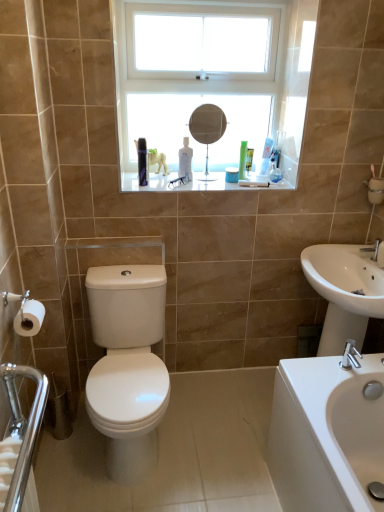
Question: Is green matte bottle at upper center, the second toiletry viewed from the top, positioned with its back to white glossy sink at lower right, which appears as the first sink when ordered from the bottom?

Choices:
 (A) yes
 (B) no

Answer: (B)

Question: Is green matte bottle at upper center, which appears as the 2th toiletry when viewed from the right, behind white glossy sink at lower right, which appears as the first sink when ordered from the bottom?

Choices:
 (A) no
 (B) yes

Answer: (B)

Question: Can you confirm if green matte bottle at upper center, placed as the first toiletry when sorted from left to right, is bigger than white glossy sink at lower right, which appears as the first sink when ordered from the bottom?

Choices:
 (A) yes
 (B) no

Answer: (B)

Question: From a real-world perspective, is green matte bottle at upper center, which appears as the first toiletry when ordered from the bottom, on top of white glossy sink at lower right, which appears as the first sink when ordered from the bottom?

Choices:
 (A) yes
 (B) no

Answer: (A)

Question: Does green matte bottle at upper center, the second toiletry viewed from the top, have a greater height compared to white glossy sink at lower right, which appears as the first sink when ordered from the bottom?

Choices:
 (A) no
 (B) yes

Answer: (A)

Question: Is green matte bottle at upper center, the second toiletry viewed from the top, next to white glossy sink at lower right, which appears as the first sink when ordered from the bottom?

Choices:
 (A) no
 (B) yes

Answer: (A)

Question: From a real-world perspective, is translucent plastic toothbrush at upper center, marked as the first toiletry in a right-to-left arrangement, physically below white matte toilet paper at lower left?

Choices:
 (A) no
 (B) yes

Answer: (A)

Question: Is translucent plastic toothbrush at upper center, marked as the first toiletry in a right-to-left arrangement, bigger than white matte toilet paper at lower left?

Choices:
 (A) no
 (B) yes

Answer: (B)

Question: From a real-world perspective, is translucent plastic toothbrush at upper center, which ranks as the first toiletry in top-to-bottom order, located higher than white matte toilet paper at lower left?

Choices:
 (A) yes
 (B) no

Answer: (A)

Question: Considering the relative sizes of translucent plastic toothbrush at upper center, positioned as the first toiletry in back-to-front order, and white matte toilet paper at lower left in the image provided, is translucent plastic toothbrush at upper center, positioned as the first toiletry in back-to-front order, shorter than white matte toilet paper at lower left?

Choices:
 (A) yes
 (B) no

Answer: (B)

Question: Is translucent plastic toothbrush at upper center, which ranks as the first toiletry in top-to-bottom order, wider than white matte toilet paper at lower left?

Choices:
 (A) no
 (B) yes

Answer: (A)

Question: Is translucent plastic toothbrush at upper center, which is counted as the 2th toiletry, starting from the bottom, not close to white matte toilet paper at lower left?

Choices:
 (A) yes
 (B) no

Answer: (A)

Question: Is white glass window at upper center completely or partially inside translucent plastic toothbrush at upper center, which ranks as the first toiletry in top-to-bottom order?

Choices:
 (A) yes
 (B) no

Answer: (B)